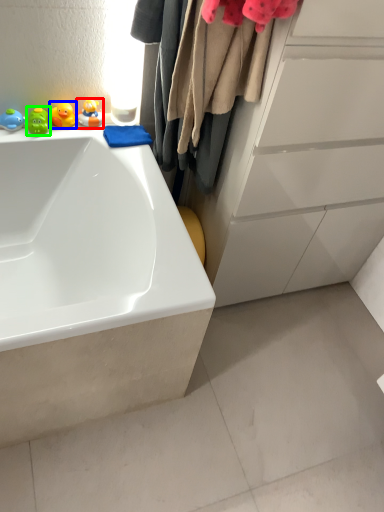
Question: Based on their relative distances, which object is nearer to toy (highlighted by a red box)? Choose from toy (highlighted by a blue box) and toy (highlighted by a green box).

Choices:
 (A) toy
 (B) toy

Answer: (A)